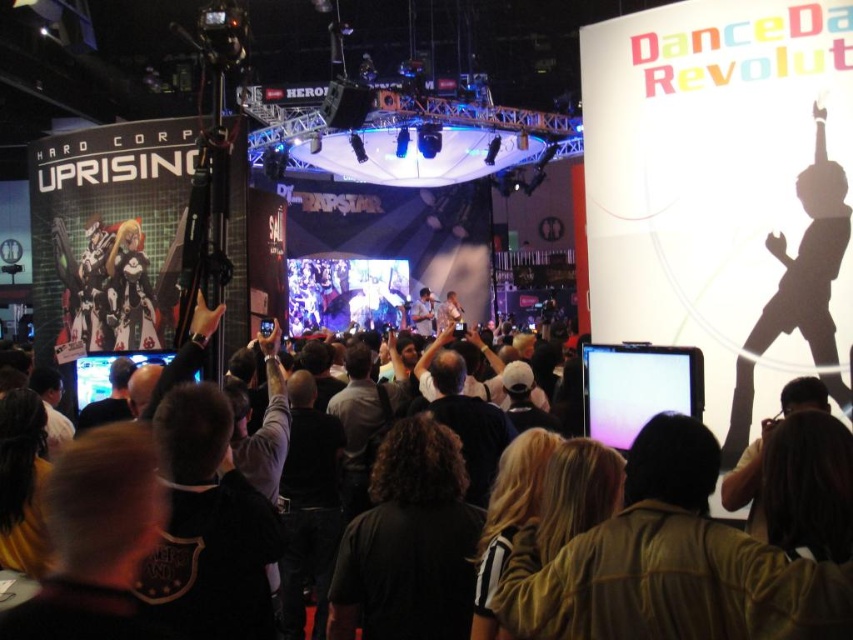
You are a stage designer setting up for a presentation. You need to place a projector that will project onto the matte black tablet at center. The projector must be placed at point 0.5, 0.5. Will the projector be able to project onto the tablet?

The matte black tablet at center is located at point (637, 387), which is further away from the projector at (426, 320), so the projector can project onto it as long as there are no obstructions between them.

You are standing at the expo and want to take a photo of the stage. There is a point at coordinates point (x=831, y=204) that you need to consider. Is this point close enough to the stage for a clear photo?

The point at (x=831, y=204) is 52.04 meters away from the viewer. Since this distance is quite far, taking a clear photo of the stage from this point may be challenging due to the distance.

You are an event organizer who needs to set up a new microphone stand. The shiny silver stage at center and the matte black monitor at center are in the way. Which object should you move to make space?

The shiny silver stage at center is positioned over the matte black monitor at center. Since the stage is larger and likely fixed in place, you should move the matte black monitor at center to make space for the microphone stand.